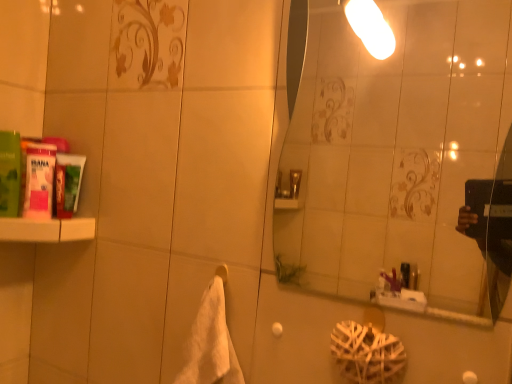
Identify the location of green matte tube at left, which appears as the third mouthwash when viewed from the left. (68, 183).

What do you see at coordinates (68, 183) in the screenshot? I see `green matte tube at left, which appears as the third mouthwash when viewed from the left` at bounding box center [68, 183].

Describe the element at coordinates (10, 173) in the screenshot. I see `green matte mouthwash at left, the 3th mouthwash from the right` at that location.

At what (x,y) coordinates should I click in order to perform the action: click on white soft towel at center. Please return your answer as a coordinate pair (x, y). Looking at the image, I should click on (210, 343).

In order to face white matte shelf at left, should I rotate leftwards or rightwards?

A 27.565 degree turn to the left will do.

This screenshot has width=512, height=384. What do you see at coordinates (399, 151) in the screenshot?
I see `transparent glass mirror at upper center` at bounding box center [399, 151].

Looking at this image, measure the distance between white matte towel bar at lower center and camera.

35.80 inches.

This screenshot has width=512, height=384. I want to click on pink matte tube at left, the 2th mouthwash from the left, so click(x=39, y=181).

Is pink matte tube at left, the 2th mouthwash from the left, in contact with white matte shelf at left?

Yes, the surface of pink matte tube at left, the 2th mouthwash from the left, is in contact with white matte shelf at left.

From the image's perspective, which object appears higher, pink matte tube at left, the 2th mouthwash from the left, or white matte shelf at left?

pink matte tube at left, the 2th mouthwash from the left, appears higher in the image.

Considering the relative sizes of pink matte tube at left, the 2th mouthwash from the left, and white matte shelf at left in the image provided, is pink matte tube at left, the 2th mouthwash from the left, thinner than white matte shelf at left?

Indeed, pink matte tube at left, the 2th mouthwash from the left, has a lesser width compared to white matte shelf at left.

From a real-world perspective, which object rests below the other?

white soft towel at center.

In terms of width, does white soft towel at center look wider or thinner when compared to transparent glass mirror at upper center?

In the image, white soft towel at center appears to be wider than transparent glass mirror at upper center.

Is white soft towel at center to the left of transparent glass mirror at upper center from the viewer's perspective?

Yes.

Consider the image. Is transparent glass mirror at upper center located within white soft towel at center?

No, transparent glass mirror at upper center is not surrounded by white soft towel at center.

Looking at their sizes, would you say pink matte tube at left, the 2th mouthwash from the left, is wider or thinner than white soft towel at center?

Clearly, pink matte tube at left, the 2th mouthwash from the left, has less width compared to white soft towel at center.

Is point (26, 207) less distant than point (221, 278)?

No, it is behind (221, 278).

From a real-world perspective, which is physically below, pink matte tube at left, placed as the 2th mouthwash when sorted from right to left, or white soft towel at center?

From a 3D spatial view, white soft towel at center is below.

Find the location of a particular element. This screenshot has height=384, width=512. the 1st mouthwash below the transparent glass mirror at upper center (from the image's perspective) is located at coordinates (10, 173).

How much distance is there between transparent glass mirror at upper center and green matte mouthwash at left, the 3th mouthwash from the right?

transparent glass mirror at upper center is 6.45 feet away from green matte mouthwash at left, the 3th mouthwash from the right.

Could you tell me if transparent glass mirror at upper center is facing green matte mouthwash at left, the 3th mouthwash from the right?

No, transparent glass mirror at upper center does not turn towards green matte mouthwash at left, the 3th mouthwash from the right.

Considering their positions, is transparent glass mirror at upper center located in front of or behind green matte mouthwash at left, the 3th mouthwash from the right?

Visually, transparent glass mirror at upper center is located in front of green matte mouthwash at left, the 3th mouthwash from the right.

Does pink matte tube at left, the 2th mouthwash from the left, have a smaller size compared to green matte mouthwash at left, the 3th mouthwash from the right?

Indeed, pink matte tube at left, the 2th mouthwash from the left, has a smaller size compared to green matte mouthwash at left, the 3th mouthwash from the right.

The height and width of the screenshot is (384, 512). In order to click on mouthwash on the left of pink matte tube at left, the 2th mouthwash from the left in this screenshot , I will do `click(10, 173)`.

Which is correct: pink matte tube at left, the 2th mouthwash from the left, is inside green matte mouthwash at left, the 3th mouthwash from the right, or outside of it?

The correct answer is: outside.

Is pink matte tube at left, the 2th mouthwash from the left, positioned behind green matte mouthwash at left, the 1th mouthwash in the left-to-right sequence?

That is True.

Based on the photo, from a real-world perspective, is pink matte tube at left, the 2th mouthwash from the left, physically located above or below white matte towel bar at lower center?

In terms of real-world spatial position, pink matte tube at left, the 2th mouthwash from the left, is above white matte towel bar at lower center.

Considering the sizes of pink matte tube at left, the 2th mouthwash from the left, and white matte towel bar at lower center in the image, is pink matte tube at left, the 2th mouthwash from the left, wider or thinner than white matte towel bar at lower center?

In the image, pink matte tube at left, the 2th mouthwash from the left, appears to be wider than white matte towel bar at lower center.

Is point (26, 190) closer or farther from the camera than point (275, 332)?

Point (26, 190) appears to be farther away from the viewer than point (275, 332).

How many degrees apart are the facing directions of pink matte tube at left, placed as the 2th mouthwash when sorted from right to left, and white matte towel bar at lower center?

The angle between the facing direction of pink matte tube at left, placed as the 2th mouthwash when sorted from right to left, and the facing direction of white matte towel bar at lower center is 86.7 degrees.

Considering the sizes of objects white matte shelf at left and transparent glass mirror at upper center in the image provided, who is bigger, white matte shelf at left or transparent glass mirror at upper center?

white matte shelf at left is bigger.

From their relative heights in the image, would you say white matte shelf at left is taller or shorter than transparent glass mirror at upper center?

white matte shelf at left is shorter than transparent glass mirror at upper center.

Is transparent glass mirror at upper center surrounded by white matte shelf at left?

No.

Which is in front, point (84, 222) or point (444, 286)?

Point (84, 222)

What are the coordinates of `shelf on the left of pink matte tube at left, placed as the 2th mouthwash when sorted from right to left` in the screenshot? It's located at (47, 230).

You are a GUI agent. You are given a task and a screenshot of the screen. Output one action in this format:
    pyautogui.click(x=<x>, y=<y>)
    Task: Click on the bath towel that is behind the transparent glass mirror at upper center
    Image resolution: width=512 pixels, height=384 pixels.
    Given the screenshot: What is the action you would take?
    pyautogui.click(x=210, y=343)

Which object lies nearer to the anchor point green matte mouthwash at left, the 1th mouthwash in the left-to-right sequence, transparent glass mirror at upper center or white soft towel at center?

white soft towel at center lies closer to green matte mouthwash at left, the 1th mouthwash in the left-to-right sequence, than the other object.

From the image, which object appears to be farther from white matte towel bar at lower center, green matte mouthwash at left, the 3th mouthwash from the right, or green matte tube at left, which appears as the third mouthwash when viewed from the left?

Among the two, green matte mouthwash at left, the 3th mouthwash from the right, is located further to white matte towel bar at lower center.

Based on their spatial positions, is white matte shelf at left or white soft towel at center closer to pink matte tube at left, the 2th mouthwash from the left?

Based on the image, white matte shelf at left appears to be nearer to pink matte tube at left, the 2th mouthwash from the left.

Which object lies nearer to the anchor point transparent glass mirror at upper center, green matte tube at left, the first mouthwash in the right-to-left sequence, or green matte mouthwash at left, the 3th mouthwash from the right?

green matte tube at left, the first mouthwash in the right-to-left sequence, lies closer to transparent glass mirror at upper center than the other object.

Which object lies nearer to the anchor point green matte mouthwash at left, the 3th mouthwash from the right, white soft towel at center or green matte tube at left, which appears as the third mouthwash when viewed from the left?

green matte tube at left, which appears as the third mouthwash when viewed from the left.

Estimate the real-world distances between objects in this image. Which object is further from pink matte tube at left, the 2th mouthwash from the left, green matte mouthwash at left, the 1th mouthwash in the left-to-right sequence, or white matte towel bar at lower center?

white matte towel bar at lower center.

Estimate the real-world distances between objects in this image. Which object is further from white soft towel at center, white matte shelf at left or transparent glass mirror at upper center?

transparent glass mirror at upper center is positioned further to the anchor white soft towel at center.

Considering their positions, is green matte mouthwash at left, the 1th mouthwash in the left-to-right sequence, positioned closer to transparent glass mirror at upper center than green matte tube at left, which appears as the third mouthwash when viewed from the left?

The object closer to transparent glass mirror at upper center is green matte tube at left, which appears as the third mouthwash when viewed from the left.

Locate an element on the screen. Image resolution: width=512 pixels, height=384 pixels. mouthwash situated between pink matte tube at left, placed as the 2th mouthwash when sorted from right to left, and white matte towel bar at lower center from left to right is located at coordinates (68, 183).

Locate an element on the screen. bath towel between green matte tube at left, which appears as the third mouthwash when viewed from the left, and white matte towel bar at lower center is located at coordinates (210, 343).

I want to click on towel bar between pink matte tube at left, placed as the 2th mouthwash when sorted from right to left, and transparent glass mirror at upper center, so click(x=277, y=329).

I want to click on mouthwash between pink matte tube at left, the 2th mouthwash from the left, and white soft towel at center from left to right, so click(x=68, y=183).